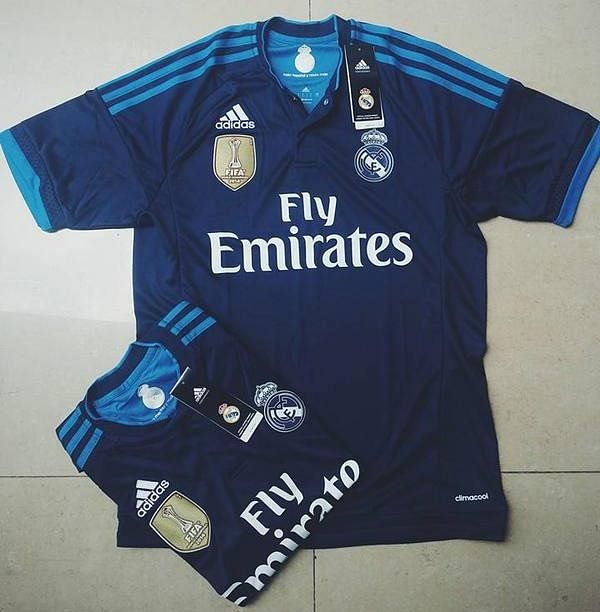
Locate an element on the screen. This screenshot has width=600, height=612. greyish, white tile background is located at coordinates (9, 507).